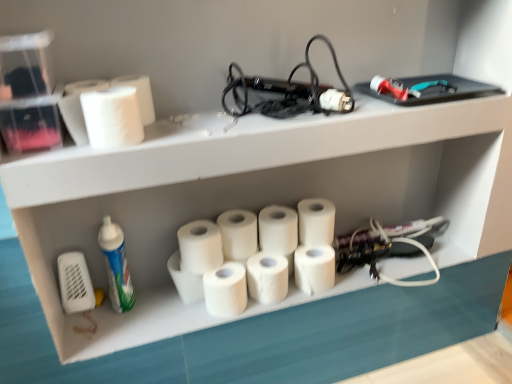
Question: Is white matte paper towel at center, arranged as the seventh paper towel when viewed from the right, positioned behind white matte paper towel at center, arranged as the sixth paper towel when viewed from the right?

Choices:
 (A) yes
 (B) no

Answer: (A)

Question: Is white matte paper towel at center, the 5th paper towel from the left, completely or partially inside white matte paper towel at center, arranged as the seventh paper towel when viewed from the right?

Choices:
 (A) no
 (B) yes

Answer: (A)

Question: Does white matte paper towel at center, arranged as the seventh paper towel when viewed from the right, appear on the left side of white matte paper towel at center, arranged as the sixth paper towel when viewed from the right?

Choices:
 (A) yes
 (B) no

Answer: (A)

Question: Is white matte paper towel at center, the fourth paper towel viewed from the left, taller than white matte paper towel at center, the 5th paper towel from the left?

Choices:
 (A) yes
 (B) no

Answer: (A)

Question: Is white matte paper towel at center, the fourth paper towel viewed from the left, oriented towards white matte paper towel at center, arranged as the sixth paper towel when viewed from the right?

Choices:
 (A) no
 (B) yes

Answer: (A)

Question: Does white matte paper towel at center, the fourth paper towel viewed from the left, have a lesser height compared to white matte paper towel at center, arranged as the sixth paper towel when viewed from the right?

Choices:
 (A) yes
 (B) no

Answer: (B)

Question: From the image's perspective, is white matte paper towel at center, arranged as the sixth paper towel when viewed from the right, located beneath white matte paper towel at center, the sixth paper towel when ordered from left to right?

Choices:
 (A) no
 (B) yes

Answer: (B)

Question: Does white matte paper towel at center, arranged as the sixth paper towel when viewed from the right, have a lesser height compared to white matte paper towel at center, the 5th paper towel viewed from the right?

Choices:
 (A) no
 (B) yes

Answer: (B)

Question: Considering the relative sizes of white matte paper towel at center, arranged as the sixth paper towel when viewed from the right, and white matte paper towel at center, the sixth paper towel when ordered from left to right, in the image provided, is white matte paper towel at center, arranged as the sixth paper towel when viewed from the right, taller than white matte paper towel at center, the sixth paper towel when ordered from left to right,?

Choices:
 (A) yes
 (B) no

Answer: (B)

Question: Are white matte paper towel at center, the 5th paper towel from the left, and white matte paper towel at center, the sixth paper towel when ordered from left to right, beside each other?

Choices:
 (A) yes
 (B) no

Answer: (A)

Question: Is white matte paper towel at center, arranged as the sixth paper towel when viewed from the right, positioned far away from white matte paper towel at center, the sixth paper towel when ordered from left to right?

Choices:
 (A) no
 (B) yes

Answer: (A)

Question: Can you confirm if white matte paper towel at center, arranged as the sixth paper towel when viewed from the right, is thinner than white matte paper towel at center, the sixth paper towel when ordered from left to right?

Choices:
 (A) no
 (B) yes

Answer: (B)

Question: Considering the relative positions of white matte paper towel at center, the 8th paper towel in the right-to-left sequence, and white matte paper towel at center, which appears as the eighth paper towel when viewed from the left, in the image provided, is white matte paper towel at center, the 8th paper towel in the right-to-left sequence, in front of white matte paper towel at center, which appears as the eighth paper towel when viewed from the left,?

Choices:
 (A) yes
 (B) no

Answer: (A)